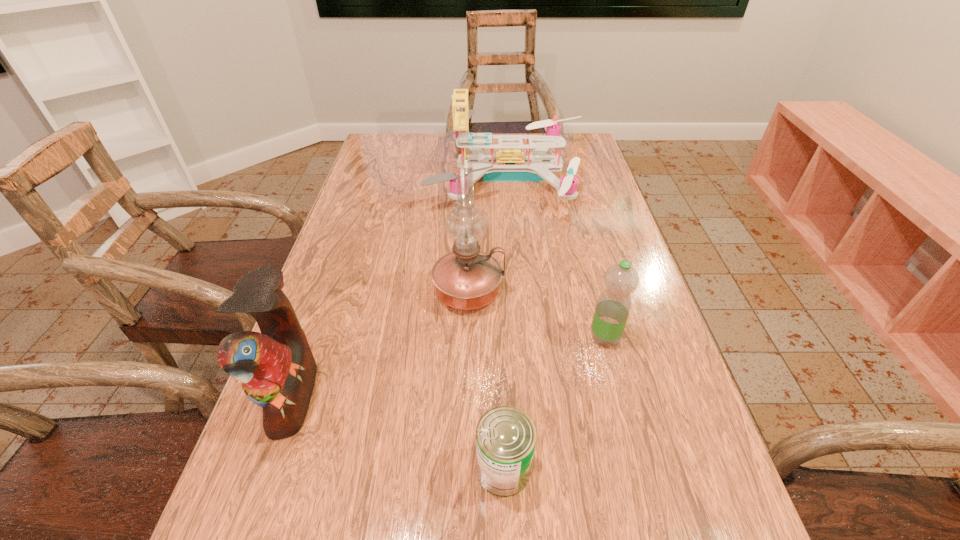
Find the location of `oil lamp`. oil lamp is located at coordinates (466, 279).

Find the location of a particular element. Image resolution: width=960 pixels, height=540 pixels. the fourth nearest object is located at coordinates (466, 279).

Where is `the farthest object`? The height and width of the screenshot is (540, 960). the farthest object is located at coordinates (509, 164).

At what (x,y) coordinates should I click in order to perform the action: click on parrot. Please return your answer as a coordinate pair (x, y). This screenshot has height=540, width=960. Looking at the image, I should click on (277, 370).

What are the coordinates of `water bottle` in the screenshot? It's located at (613, 306).

Locate an element on the screen. The image size is (960, 540). the fourth tallest object is located at coordinates (613, 306).

Locate an element on the screen. The image size is (960, 540). the shortest object is located at coordinates (506, 436).

Image resolution: width=960 pixels, height=540 pixels. I want to click on free location located 0.250m on the left of the tallest object, so click(x=322, y=292).

Identify the location of free space located 0.090m on the front-facing side of the farthest object. (401, 177).

Locate an element on the screen. The height and width of the screenshot is (540, 960). vacant region located 0.210m on the front-facing side of the farthest object is located at coordinates (362, 177).